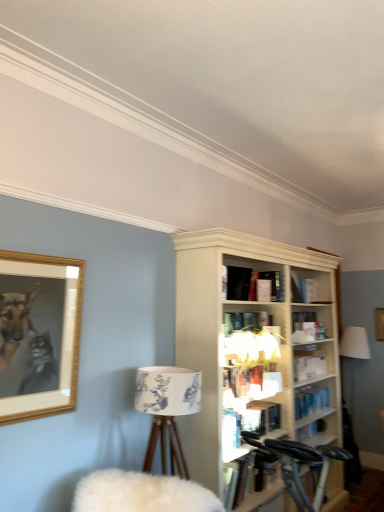
Question: Is white fabric lampshade at upper center outside hardcover book at center, arranged as the 2th book when viewed from the top?

Choices:
 (A) yes
 (B) no

Answer: (A)

Question: Is white fabric lampshade at upper center turned away from hardcover book at center, arranged as the 2th book when viewed from the top?

Choices:
 (A) yes
 (B) no

Answer: (B)

Question: Does white fabric lampshade at upper center have a smaller size compared to hardcover book at center, the 1th book ordered from the bottom?

Choices:
 (A) yes
 (B) no

Answer: (B)

Question: Does white fabric lampshade at upper center have a lesser height compared to hardcover book at center, arranged as the 2th book when viewed from the top?

Choices:
 (A) yes
 (B) no

Answer: (B)

Question: Are white fabric lampshade at upper center and hardcover book at center, the 1th book ordered from the bottom, located far from each other?

Choices:
 (A) yes
 (B) no

Answer: (B)

Question: From a real-world perspective, is white fabric lampshade at upper center located beneath hardcover book at center, arranged as the 2th book when viewed from the top?

Choices:
 (A) no
 (B) yes

Answer: (A)

Question: Is metallic silver bicycle at lower right thinner than white fabric lampshade at lower right?

Choices:
 (A) no
 (B) yes

Answer: (A)

Question: Can you confirm if metallic silver bicycle at lower right is shorter than white fabric lampshade at lower right?

Choices:
 (A) no
 (B) yes

Answer: (B)

Question: Is white fabric lampshade at lower right surrounded by metallic silver bicycle at lower right?

Choices:
 (A) no
 (B) yes

Answer: (A)

Question: Can you confirm if metallic silver bicycle at lower right is bigger than white fabric lampshade at lower right?

Choices:
 (A) yes
 (B) no

Answer: (A)

Question: Is the position of metallic silver bicycle at lower right less distant than that of white fabric lampshade at lower right?

Choices:
 (A) yes
 (B) no

Answer: (A)

Question: Can you confirm if metallic silver bicycle at lower right is positioned to the right of white fabric lampshade at lower right?

Choices:
 (A) yes
 (B) no

Answer: (B)

Question: From a real-world perspective, is hardcover book at center, arranged as the 2th book when viewed from the top, under metallic silver bicycle at lower right?

Choices:
 (A) no
 (B) yes

Answer: (A)